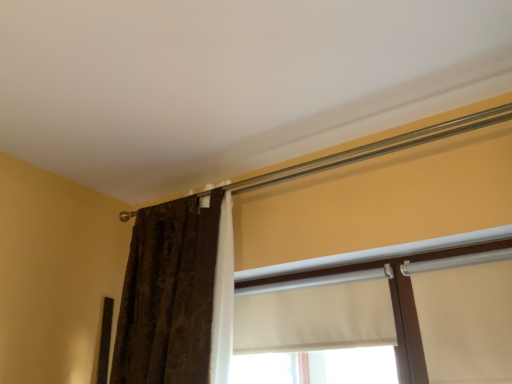
Question: Looking at their shapes, would you say white matte window at center, which is counted as the second window, starting from the right, is wider or thinner than white fabric at center, the 1th window positioned from the right?

Choices:
 (A) thin
 (B) wide

Answer: (A)

Question: In terms of height, does white matte window at center, which is counted as the second window, starting from the right, look taller or shorter compared to white fabric at center, the 1th window positioned from the right?

Choices:
 (A) short
 (B) tall

Answer: (A)

Question: Estimate the real-world distances between objects in this image. Which object is closer to the white fabric at center, the 1th window positioned from the right?

Choices:
 (A) white matte window at center, marked as the 1th window in a left-to-right arrangement
 (B) brown textured curtain at left

Answer: (A)

Question: Estimate the real-world distances between objects in this image. Which object is closer to the white fabric at center, the second window positioned from the left?

Choices:
 (A) white matte window at center, marked as the 1th window in a left-to-right arrangement
 (B) brown textured curtain at left

Answer: (A)